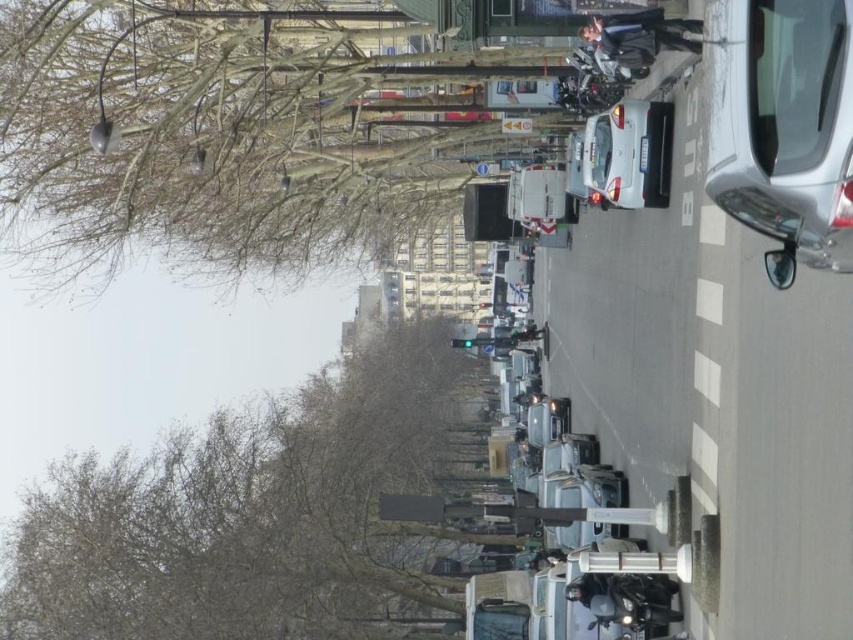
You are standing at the intersection looking down the street. There is a silver metallic car at right located at point (782,125). If you want to cross the street from the left side where the leafless trees are, will you pass by the silver metallic car at right before reaching the middle of the street?

The silver metallic car at right is located at point (782,125). Since you are crossing from the left side towards the middle of the street, you would first pass by the silver metallic car at right before reaching the middle.

You are a delivery person trying to navigate through the busy street. You notice a white glossy car at center and some bare branches at left. Which object is larger in size?

The bare branches at left is bigger than the white glossy car at center.